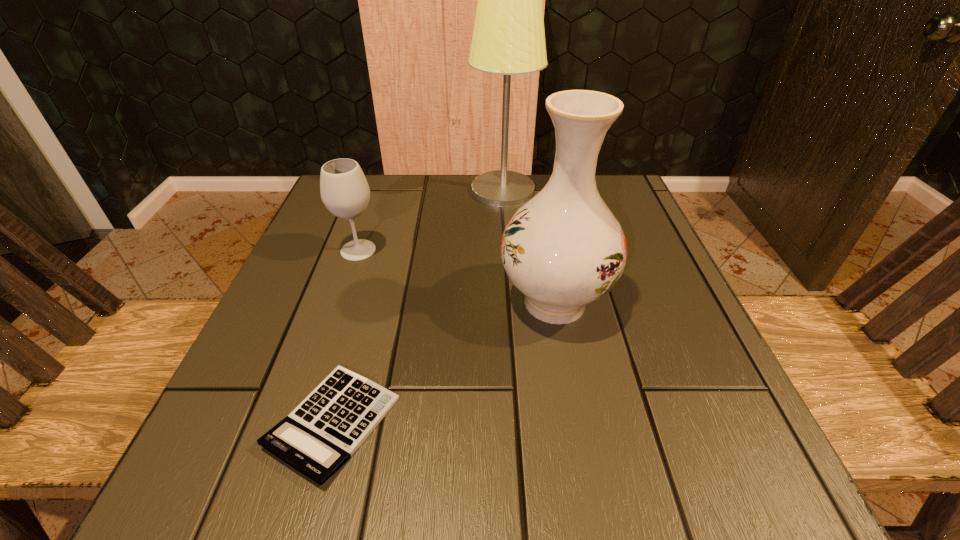
Where is `vacant region at the right edge`? This screenshot has height=540, width=960. vacant region at the right edge is located at coordinates (691, 358).

Find the location of a particular element. free point at the far left corner is located at coordinates coord(383,201).

In the image, there is a desktop. What are the coordinates of `vacant area at the far right corner` in the screenshot? It's located at (637, 217).

Where is `free space at the near right corner of the desktop`? free space at the near right corner of the desktop is located at coordinates pos(709,482).

Locate an element on the screen. This screenshot has width=960, height=540. unoccupied area between the table lamp and the calculator is located at coordinates (419, 306).

Identify the location of free space between the wineglass and the tallest object. This screenshot has height=540, width=960. (431, 220).

Where is `vacant area between the second farthest object and the third shortest object`? This screenshot has width=960, height=540. vacant area between the second farthest object and the third shortest object is located at coordinates (457, 276).

Find the location of a particular element. free spot between the third nearest object and the farthest object is located at coordinates (431, 220).

The width and height of the screenshot is (960, 540). In order to click on vacant space in between the second shortest object and the second nearest object in this screenshot , I will do [457, 276].

This screenshot has height=540, width=960. I want to click on empty space between the third nearest object and the farthest object, so pyautogui.click(x=431, y=220).